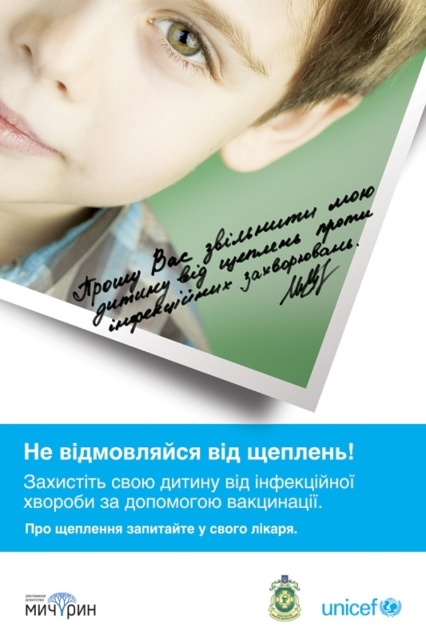
Question: Which of the following is the farthest from the observer?

Choices:
 (A) green matte eye at upper center
 (B) smooth skin face at upper center

Answer: (A)

Question: Which object is positioned farthest from the green matte eye at upper center?

Choices:
 (A) smooth skin face at upper center
 (B) matte skin face at upper center

Answer: (A)

Question: Is smooth skin face at upper center closer to camera compared to green matte eye at upper center?

Choices:
 (A) no
 (B) yes

Answer: (B)

Question: Does matte skin face at upper center appear on the right side of green matte eye at upper center?

Choices:
 (A) no
 (B) yes

Answer: (A)

Question: Is matte skin face at upper center behind green matte eye at upper center?

Choices:
 (A) no
 (B) yes

Answer: (A)

Question: Among these points, which one is nearest to the camera?

Choices:
 (A) coord(195,58)
 (B) coord(253,20)
 (C) coord(86,93)

Answer: (B)